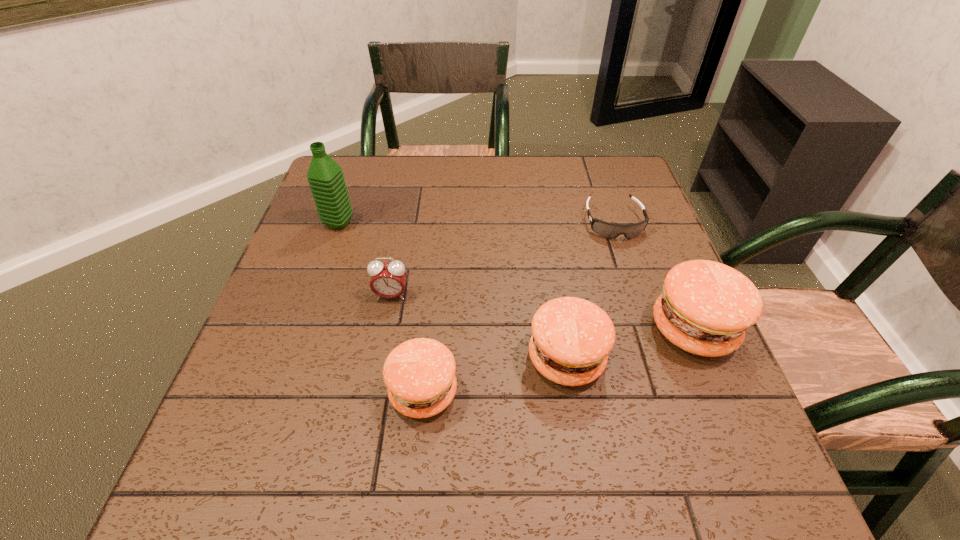
This screenshot has width=960, height=540. Find the location of `the leftmost patty`. the leftmost patty is located at coordinates (420, 376).

You are a GUI agent. You are given a task and a screenshot of the screen. Output one action in this format:
    pyautogui.click(x=<x>, y=<y>)
    Task: Click on the fourth object from left to right
    
    Given the screenshot: What is the action you would take?
    pyautogui.click(x=572, y=337)

The image size is (960, 540). Identify the location of the second shortest patty. (572, 337).

Locate an element on the screen. Image resolution: width=960 pixels, height=540 pixels. the rightmost patty is located at coordinates (705, 308).

The height and width of the screenshot is (540, 960). Find the location of `water bottle`. water bottle is located at coordinates (325, 177).

The width and height of the screenshot is (960, 540). Identify the location of the tallest object. (325, 177).

Where is `goggles`? The width and height of the screenshot is (960, 540). goggles is located at coordinates coord(607,230).

At what (x,y) coordinates should I click in order to perform the action: click on alarm clock. Please return your answer as a coordinate pair (x, y). This screenshot has height=540, width=960. Looking at the image, I should click on (388, 280).

Identify the location of vacant space situated 0.220m on the back of the leftmost patty. (435, 280).

Locate an element on the screen. This screenshot has width=960, height=540. free region located on the back of the fourth object from left to right is located at coordinates (548, 244).